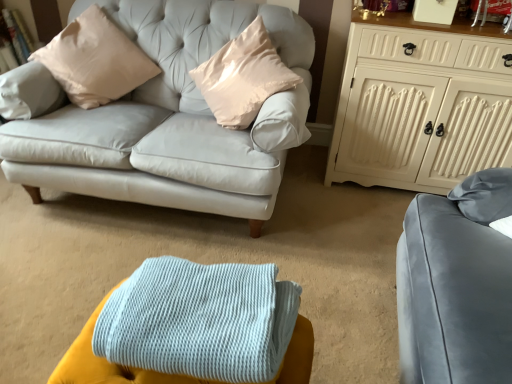
Question: Can you confirm if light blue knitted blanket at lower center is positioned to the right of white painted wood cabinet at upper right?

Choices:
 (A) yes
 (B) no

Answer: (B)

Question: Does light blue knitted blanket at lower center touch white painted wood cabinet at upper right?

Choices:
 (A) yes
 (B) no

Answer: (B)

Question: Considering the relative sizes of light blue knitted blanket at lower center and white painted wood cabinet at upper right in the image provided, is light blue knitted blanket at lower center bigger than white painted wood cabinet at upper right?

Choices:
 (A) yes
 (B) no

Answer: (B)

Question: Can you confirm if light blue knitted blanket at lower center is shorter than white painted wood cabinet at upper right?

Choices:
 (A) yes
 (B) no

Answer: (A)

Question: Does light blue knitted blanket at lower center lie in front of white painted wood cabinet at upper right?

Choices:
 (A) yes
 (B) no

Answer: (A)

Question: Is point (397, 173) positioned closer to the camera than point (124, 352)?

Choices:
 (A) farther
 (B) closer

Answer: (A)

Question: Considering the positions of white painted wood cabinet at upper right and light blue knitted blanket at lower center in the image, is white painted wood cabinet at upper right taller or shorter than light blue knitted blanket at lower center?

Choices:
 (A) short
 (B) tall

Answer: (B)

Question: Considering the positions of white painted wood cabinet at upper right and light blue knitted blanket at lower center in the image, is white painted wood cabinet at upper right wider or thinner than light blue knitted blanket at lower center?

Choices:
 (A) thin
 (B) wide

Answer: (B)

Question: From a real-world perspective, is white painted wood cabinet at upper right above or below light blue knitted blanket at lower center?

Choices:
 (A) below
 (B) above

Answer: (B)

Question: Is satin beige pillow at upper left to the left or to the right of light blue knitted blanket at lower center in the image?

Choices:
 (A) right
 (B) left

Answer: (B)

Question: From their relative heights in the image, would you say satin beige pillow at upper left is taller or shorter than light blue knitted blanket at lower center?

Choices:
 (A) short
 (B) tall

Answer: (B)

Question: Do you think satin beige pillow at upper left is within light blue knitted blanket at lower center, or outside of it?

Choices:
 (A) outside
 (B) inside

Answer: (A)

Question: From a real-world perspective, relative to light blue knitted blanket at lower center, is satin beige pillow at upper left vertically above or below?

Choices:
 (A) below
 (B) above

Answer: (B)

Question: Considering the relative positions of white painted wood cabinet at upper right and satin beige pillow at upper left in the image provided, is white painted wood cabinet at upper right to the left or to the right of satin beige pillow at upper left?

Choices:
 (A) left
 (B) right

Answer: (B)

Question: Is white painted wood cabinet at upper right situated inside satin beige pillow at upper left or outside?

Choices:
 (A) outside
 (B) inside

Answer: (A)